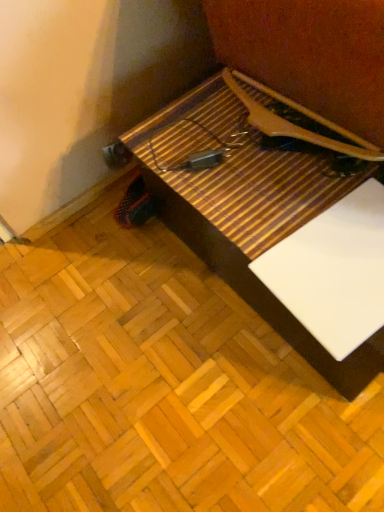
Locate an element on the screen. free space below white matte paper at lower right (from a real-world perspective) is located at coordinates (341, 266).